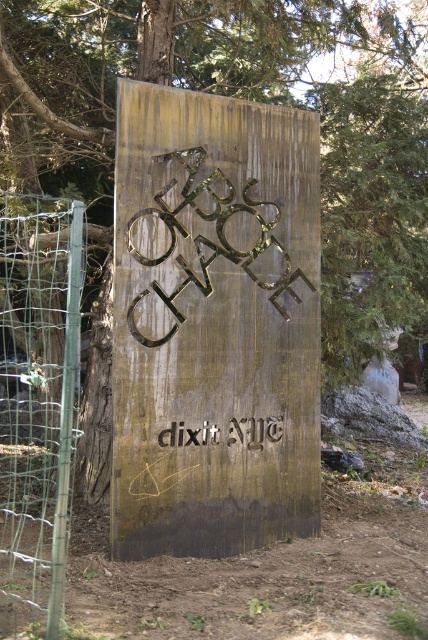
Question: Among these objects, which one is nearest to the camera?

Choices:
 (A) silver metallic text at center
 (B) rusted metal sign at center
 (C) wire mesh fence at left

Answer: (C)

Question: Is wire mesh fence at left positioned behind rusted metal sign at center?

Choices:
 (A) no
 (B) yes

Answer: (A)

Question: Considering the relative positions of brown dirt track at lower left and wire mesh fence at left in the image provided, where is brown dirt track at lower left located with respect to wire mesh fence at left?

Choices:
 (A) right
 (B) left

Answer: (A)

Question: Can you confirm if gold metallic sign at center is bigger than brown dirt track at lower left?

Choices:
 (A) yes
 (B) no

Answer: (B)

Question: Among these points, which one is nearest to the camera?

Choices:
 (A) (214, 422)
 (B) (36, 467)
 (C) (395, 464)
 (D) (284, 310)

Answer: (A)

Question: Which of the following is the farthest from the observer?

Choices:
 (A) (247, 305)
 (B) (363, 509)

Answer: (B)